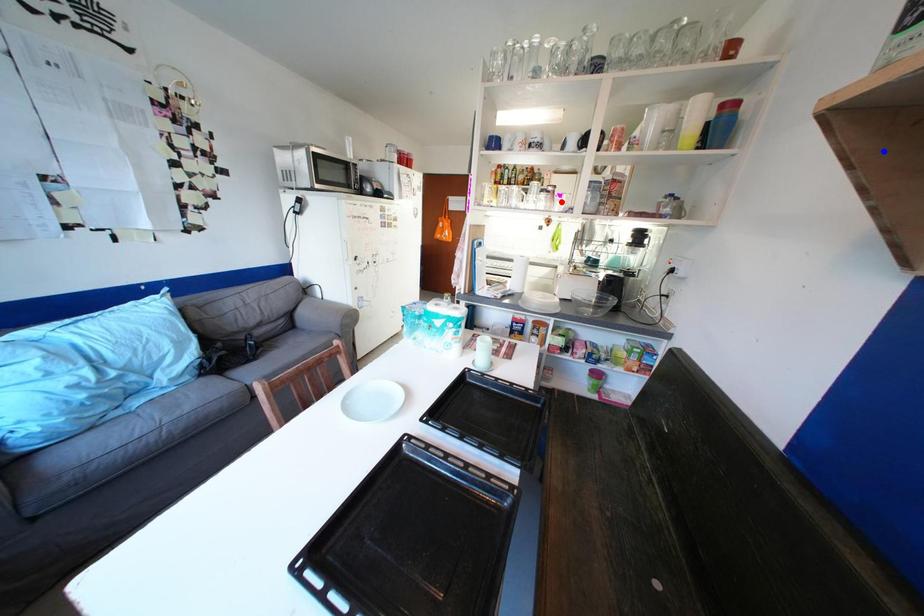
Question: Which of the two points in the image is closer to the camera?

Choices:
 (A) Blue point is closer.
 (B) Red point is closer.

Answer: (A)